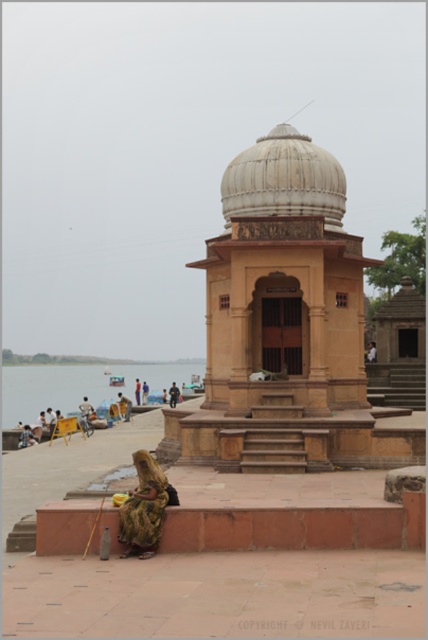
What do you see at coordinates (79, 387) in the screenshot?
I see `blue water at lower left` at bounding box center [79, 387].

Is point (174, 374) positioned after point (148, 490)?

That is True.

Locate an element on the screen. blue water at lower left is located at coordinates (79, 387).